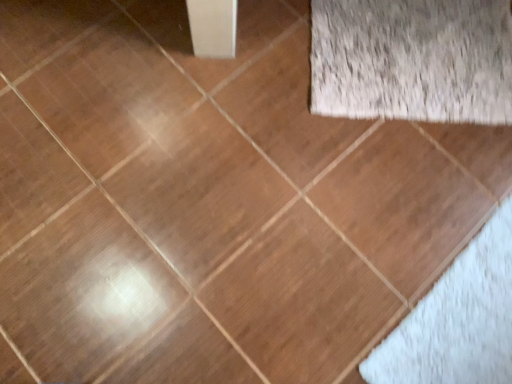
The image size is (512, 384). Identify the location of free region on the left part of white fluffy rug at upper right. (248, 80).